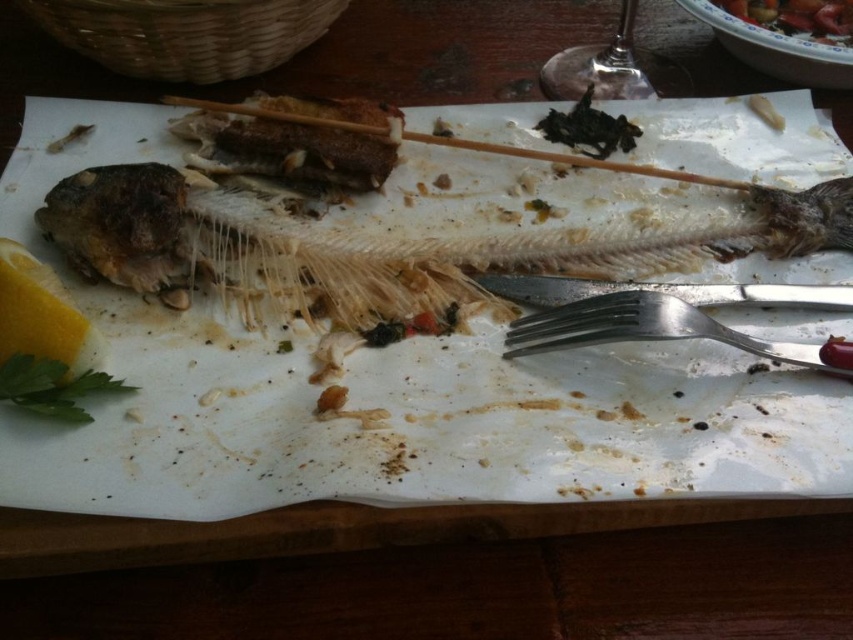
Question: Which point is farther from the camera taking this photo?

Choices:
 (A) (68, 384)
 (B) (3, 358)

Answer: (A)

Question: Which of the following is the farthest from the observer?

Choices:
 (A) (28, 324)
 (B) (315, 477)

Answer: (A)

Question: Does yellow matte lemon at lower left appear over transparent glass at upper center?

Choices:
 (A) yes
 (B) no

Answer: (B)

Question: Can you confirm if transparent glass at upper center is positioned above green leafy parsley at lower left?

Choices:
 (A) no
 (B) yes

Answer: (B)

Question: Which point is closer to the camera?

Choices:
 (A) (22, 147)
 (B) (770, 1)
 (C) (675, 92)
 (D) (26, 376)

Answer: (D)

Question: Is white paper plate at center thinner than smooth glossy bowl at upper right?

Choices:
 (A) no
 (B) yes

Answer: (A)